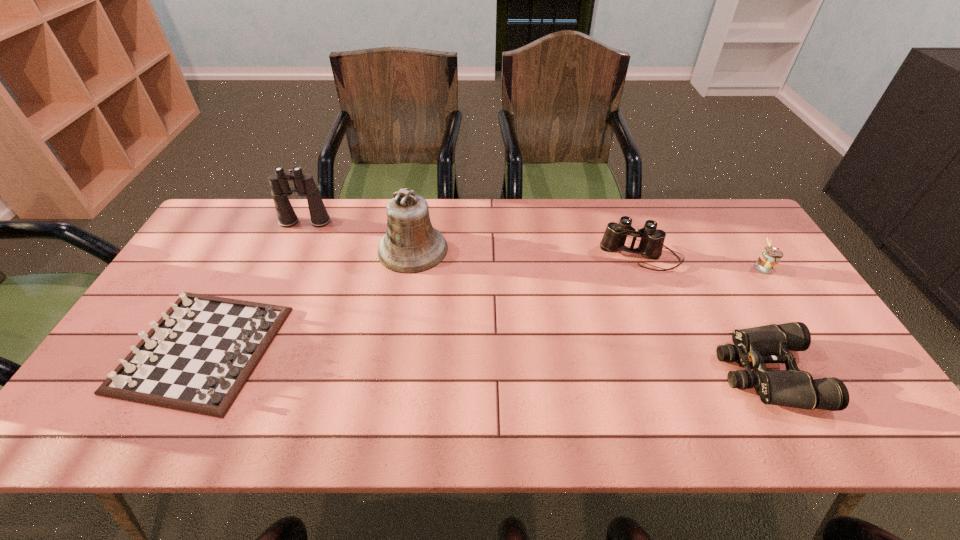
At what (x,y) coordinates should I click in order to perform the action: click on vacant space located 0.190m on the right of the farthest binoculars. Please return your answer as a coordinate pair (x, y). This screenshot has height=540, width=960. Looking at the image, I should click on (387, 222).

This screenshot has width=960, height=540. Find the location of `free spot located 0.400m on the left of the third tallest object`. free spot located 0.400m on the left of the third tallest object is located at coordinates (472, 257).

Locate an element on the screen. vacant space located on the left of the rightmost object is located at coordinates (621, 267).

At what (x,y) coordinates should I click in order to perform the action: click on free space located 0.130m through the eyepieces of the shortest binoculars. Please return your answer as a coordinate pair (x, y). The image size is (960, 540). Looking at the image, I should click on (668, 373).

At what (x,y) coordinates should I click in order to perform the action: click on vacant space located through the eyepieces of the shortest binoculars. Please return your answer as a coordinate pair (x, y). Looking at the image, I should click on tap(656, 373).

Where is `blank area located through the eyepieces of the shortest binoculars`? The height and width of the screenshot is (540, 960). blank area located through the eyepieces of the shortest binoculars is located at coordinates (635, 373).

Find the location of a particular element. The height and width of the screenshot is (540, 960). free point located on the back of the chessboard is located at coordinates (261, 239).

This screenshot has height=540, width=960. I want to click on bell that is at the far edge, so [x=411, y=245].

I want to click on binoculars present at the near edge, so click(x=753, y=347).

Where is `chessboard that is positioned at the near edge`? This screenshot has height=540, width=960. chessboard that is positioned at the near edge is located at coordinates (x=197, y=358).